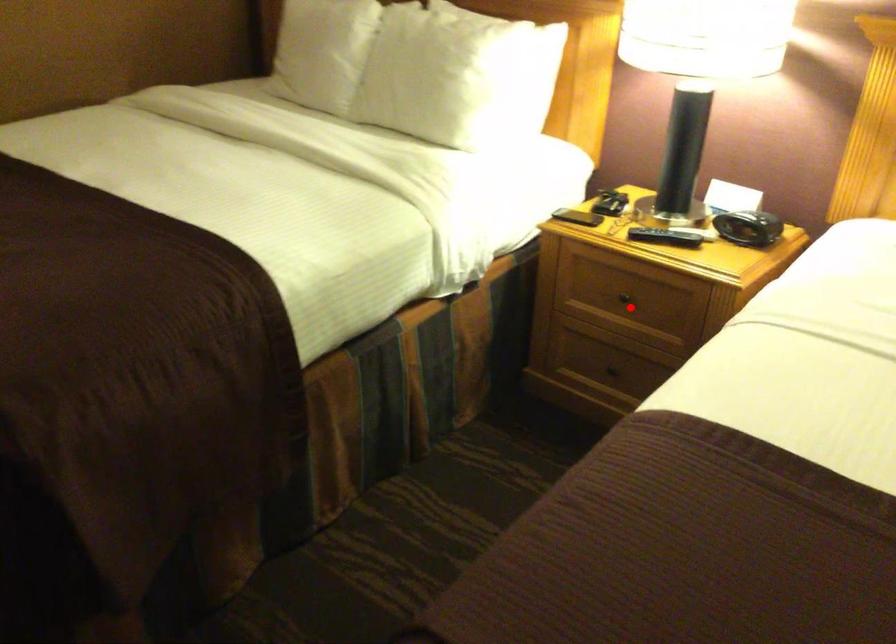
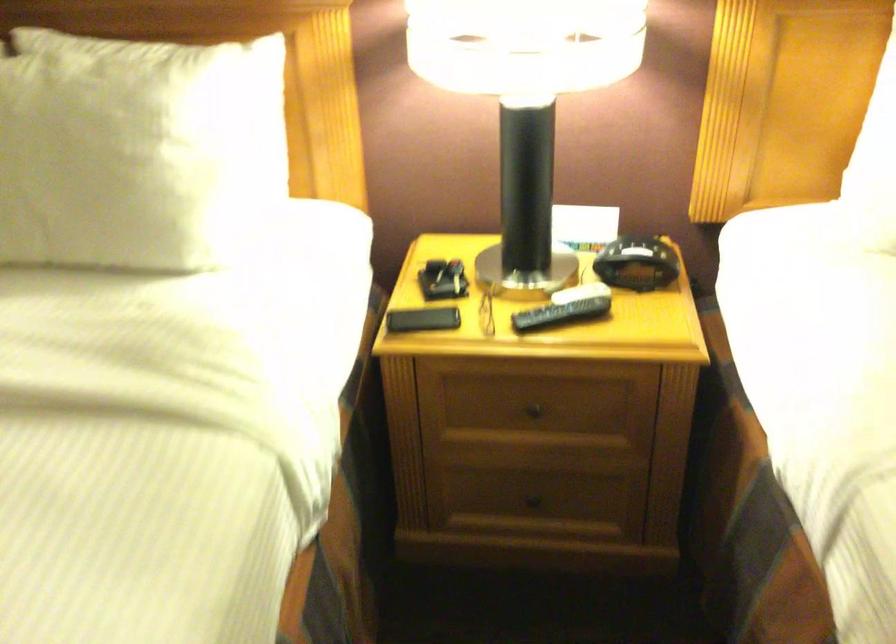
Question: I am providing you with two images of the same scene from different viewpoints. In image1, a red point is highlighted. Considering the same 3D point in image2, which of the following is correct?

Choices:
 (A) It is closer
 (B) It is farther

Answer: (A)